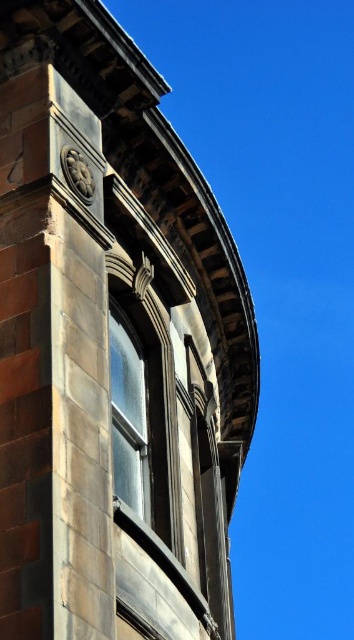
Consider the image. You are an architect designing a new building and want to ensure proper spacing between the dark gray stone window at center and the matte glass window at upper center. Based on the image, can you determine which window is wider?

The dark gray stone window at center is wider than the matte glass window at upper center according to the description.

You are an architect evaluating the symmetry of the building. Which window, the dark gray stone window at center or the matte glass window at upper center, is positioned to the right of the other?

The dark gray stone window at center is positioned to the right of the matte glass window at upper center.

You are standing in front of the building and want to determine the relative positions of two points on its facade. Which point is closer to you, point (32,113) or point (126,275)?

Point (32,113) is closer to the viewer than point (126,275).